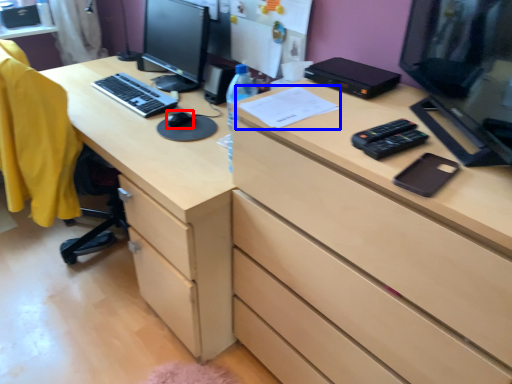
Question: Which object appears farthest to the camera in this image, mouse (highlighted by a red box) or paper (highlighted by a blue box)?

Choices:
 (A) mouse
 (B) paper

Answer: (A)